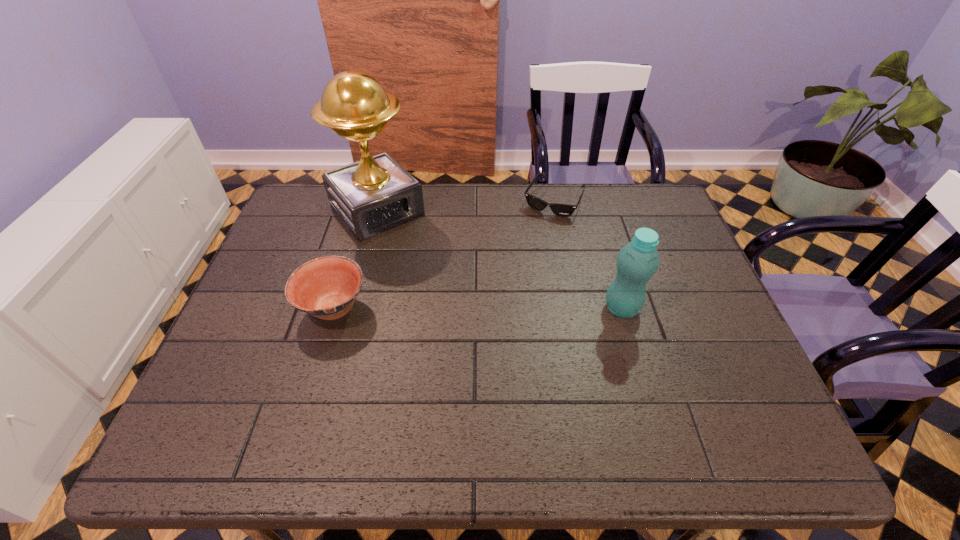
Locate an element on the screen. This screenshot has width=960, height=540. vacant space positioned on the front-facing side of the tallest object is located at coordinates (455, 296).

Locate an element on the screen. The image size is (960, 540). free space located 0.170m on the front-facing side of the tallest object is located at coordinates (431, 269).

Where is `sunglasses located at the far edge`? sunglasses located at the far edge is located at coordinates (564, 210).

You are a GUI agent. You are given a task and a screenshot of the screen. Output one action in this format:
    pyautogui.click(x=<x>, y=<y>)
    Task: Click on the award that is at the far edge
    This screenshot has width=960, height=540.
    Given the screenshot: What is the action you would take?
    pyautogui.click(x=376, y=194)

The height and width of the screenshot is (540, 960). I want to click on bowl located at the left edge, so click(326, 287).

Identify the location of award that is at the left edge. Image resolution: width=960 pixels, height=540 pixels. (376, 194).

Identify the location of object present at the far left corner. The height and width of the screenshot is (540, 960). (376, 194).

Where is `free space at the far edge of the desktop`? The height and width of the screenshot is (540, 960). free space at the far edge of the desktop is located at coordinates (567, 227).

In order to click on free space at the near edge of the desktop in this screenshot , I will do `click(496, 397)`.

In the image, there is a desktop. Where is `vacant space at the right edge`? This screenshot has height=540, width=960. vacant space at the right edge is located at coordinates (685, 361).